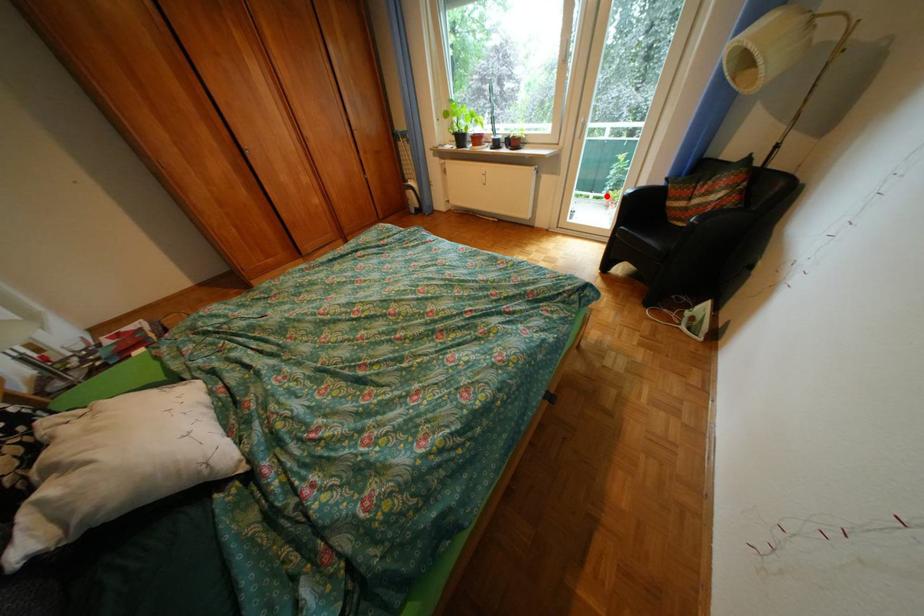
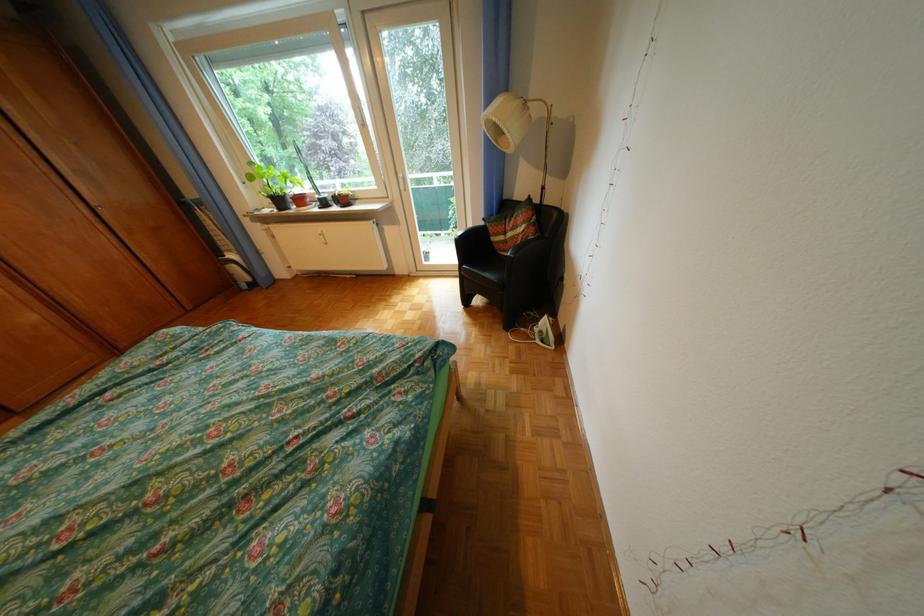
Question: I am providing you with two images of the same scene from different viewpoints. Image1 has a red point marked. In image2, the corresponding 3D location appears at what relative position? Reply with the corresponding letter.

Choices:
 (A) Closer
 (B) Farther

Answer: (B)